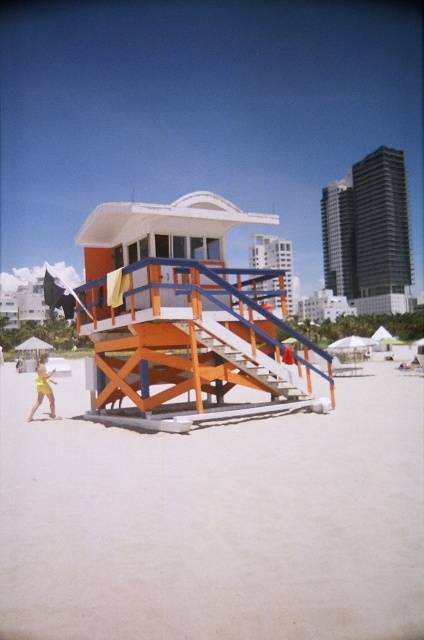
Question: Is orange wooden stairs at center wider than yellow matte swimsuit at lower left?

Choices:
 (A) yes
 (B) no

Answer: (B)

Question: From the image, what is the correct spatial relationship of orange wood lifeguard tower at center in relation to orange wooden stairs at center?

Choices:
 (A) right
 (B) left

Answer: (B)

Question: Which object appears farthest from the camera in this image?

Choices:
 (A) beige sandy beach at center
 (B) orange wooden stairs at center
 (C) orange wood lifeguard tower at center
 (D) yellow matte swimsuit at lower left

Answer: (D)

Question: Can you confirm if orange wood lifeguard tower at center is positioned to the right of yellow matte swimsuit at lower left?

Choices:
 (A) no
 (B) yes

Answer: (B)

Question: Among these objects, which one is farthest from the camera?

Choices:
 (A) orange wooden stairs at center
 (B) orange wood lifeguard tower at center

Answer: (A)

Question: Estimate the real-world distances between objects in this image. Which object is closer to the beige sandy beach at center?

Choices:
 (A) yellow matte swimsuit at lower left
 (B) orange wooden stairs at center
 (C) orange wood lifeguard tower at center

Answer: (B)